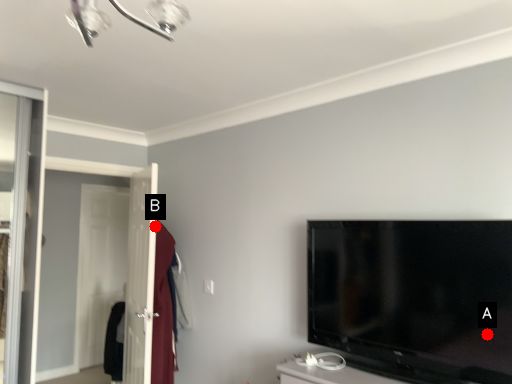
Question: Two points are circled on the image, labeled by A and B beside each circle. Among these points, which one is nearest to the camera?

Choices:
 (A) A is closer
 (B) B is closer

Answer: (A)